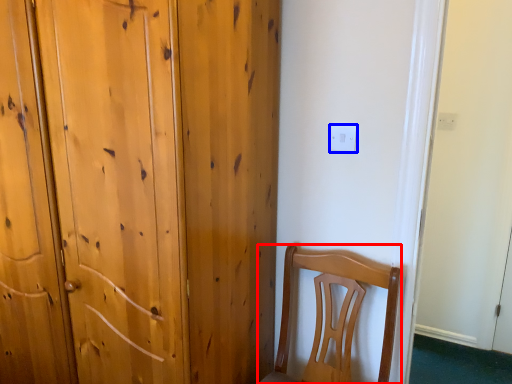
Question: Which point is further to the camera, chair (highlighted by a red box) or electric outlet (highlighted by a blue box)?

Choices:
 (A) chair
 (B) electric outlet

Answer: (B)